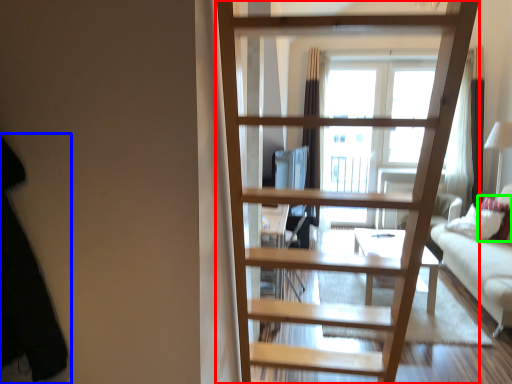
Question: Based on their relative distances, which object is farther from ladder (highlighted by a red box)? Choose from dark (highlighted by a blue box) and pillow (highlighted by a green box).

Choices:
 (A) dark
 (B) pillow

Answer: (B)